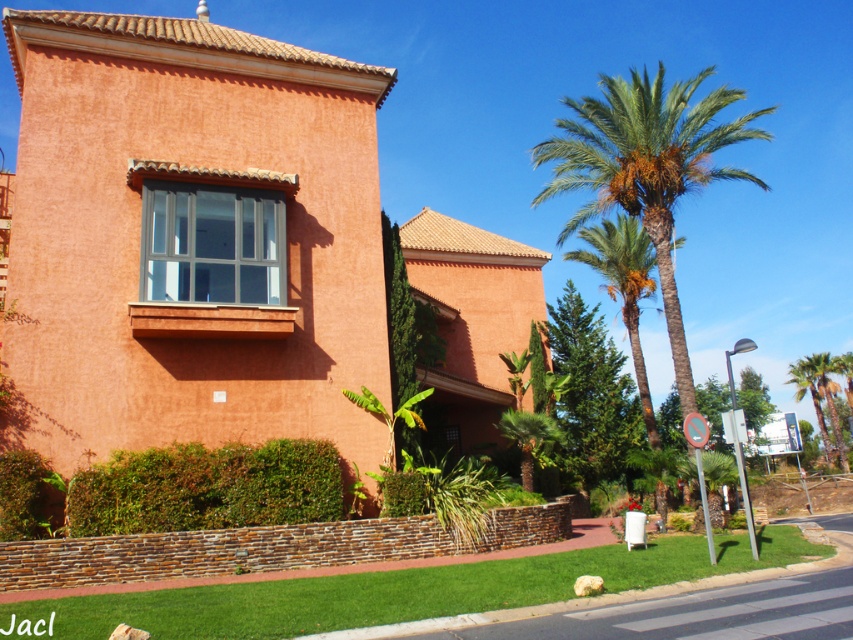
Which is more to the left, brown stone curb at lower center or green leafy palm tree at right?

brown stone curb at lower center is more to the left.

Describe the element at coordinates (602, 595) in the screenshot. The image size is (853, 640). I see `brown stone curb at lower center` at that location.

Identify the location of brown stone curb at lower center. (602, 595).

Which is below, green leafy palm at right or green leafy palm tree at right?

Positioned lower is green leafy palm tree at right.

Between green leafy palm at right and green leafy palm tree at right, which one appears on the right side from the viewer's perspective?

From the viewer's perspective, green leafy palm tree at right appears more on the right side.

Find the location of a particular element. green leafy palm at right is located at coordinates (646, 168).

I want to click on green leafy palm at right, so click(646, 168).

Does green leafy palm at right appear on the right side of brown stone curb at lower center?

Correct, you'll find green leafy palm at right to the right of brown stone curb at lower center.

At what (x,y) coordinates should I click in order to perform the action: click on green leafy palm at right. Please return your answer as a coordinate pair (x, y). This screenshot has width=853, height=640. Looking at the image, I should click on (646, 168).